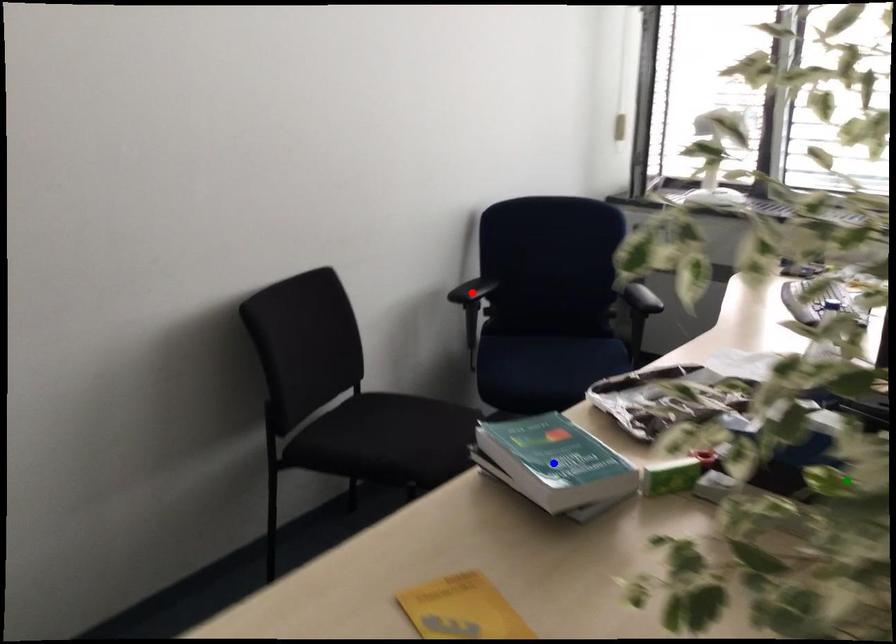
Order these from nearest to farthest:
green point, blue point, red point

red point, blue point, green point